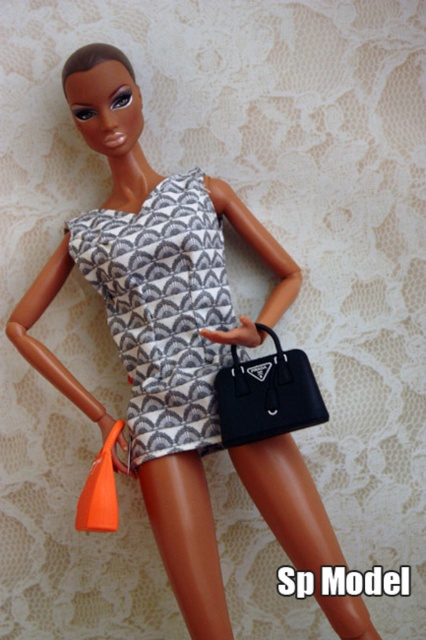
You are a photographer setting up a shot of the fashion doll. You need to adjust the lighting so that the quilted gray dress at center and the matte black handbag at lower center are both well illuminated. Since the dress is closer to you, how should you position the light source to ensure both items receive adequate light?

Since the quilted gray dress at center is closer to the viewer than the matte black handbag at lower center, you should position the light source slightly behind the doll to ensure that both items receive even illumination. This way, the light can reach the dress and the handbag effectively, compensating for their different distances from the camera.

Based on the photo, you are a fashion designer who needs to place a new accessory on the doll. The accessory must be placed at the same position as the quilted gray dress at center. What are the coordinates where you should place the accessory?

The coordinates for the quilted gray dress at center are at point (163, 308), so you should place the accessory at those coordinates.